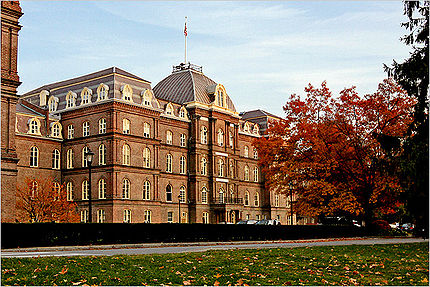
The height and width of the screenshot is (287, 430). I want to click on lamp, so click(89, 161).